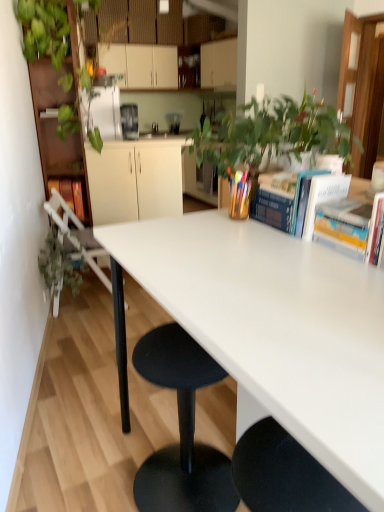
What do you see at coordinates (44, 29) in the screenshot? The image size is (384, 512). I see `green leafy plant at upper left` at bounding box center [44, 29].

Describe the element at coordinates (269, 133) in the screenshot. I see `green matte plant at center` at that location.

What is the approximate width of white plastic chair at left?

It is 20.20 inches.

Measure the distance between point [220,62] and camera.

A distance of 5.04 meters exists between point [220,62] and camera.

In order to click on matte white cabinets at upper center, placed as the second cabinetry when sorted from bottom to top in this screenshot , I will do [x=141, y=65].

This screenshot has width=384, height=512. What do you see at coordinates (323, 197) in the screenshot?
I see `blue hardcover book at upper right, positioned as the 3th book in back-to-front order` at bounding box center [323, 197].

Where is `blue hardcover book at upper right, the third book in the front-to-back sequence`? blue hardcover book at upper right, the third book in the front-to-back sequence is located at coordinates (323, 197).

What are the coordinates of `metallic silver toaster at center, the second appliance positioned from the left` in the screenshot? It's located at [174, 122].

This screenshot has width=384, height=512. What do you see at coordinates (351, 227) in the screenshot?
I see `hardcover book at upper right, the 2th book from the front` at bounding box center [351, 227].

Image resolution: width=384 pixels, height=512 pixels. Find the location of `green leafy plant at upper left`. green leafy plant at upper left is located at coordinates (44, 29).

How distant is white glossy table at center from black plastic stool at center?

They are 26.93 inches apart.

Does white glossy table at center lie in front of black plastic stool at center?

Yes, white glossy table at center is closer to the viewer.

Which point is more distant from viewer, (196, 279) or (214, 450)?

Positioned behind is point (214, 450).

Which object is positioned more to the left, white glossy table at center or black plastic stool at center?

From the viewer's perspective, black plastic stool at center appears more on the left side.

Are white plastic chair at left and green leafy plant at upper left located far from each other?

That's not correct — white plastic chair at left is a little close to green leafy plant at upper left.

Could you tell me if white plastic chair at left is turned towards green leafy plant at upper left?

No, white plastic chair at left does not turn towards green leafy plant at upper left.

The height and width of the screenshot is (512, 384). Identify the location of chair below the green leafy plant at upper left (from a real-world perspective). (78, 237).

Considering the sizes of hardcover book at upper right, acting as the 2th book starting from the back, and hardcover book at left, the 5th book from the right, in the image, is hardcover book at upper right, acting as the 2th book starting from the back, bigger or smaller than hardcover book at left, the 5th book from the right,?

In the image, hardcover book at upper right, acting as the 2th book starting from the back, appears to be smaller than hardcover book at left, the 5th book from the right.

Which is closer, (272, 196) or (67, 185)?

The point (272, 196) is closer.

Considering the sizes of objects hardcover book at upper right, positioned as the 4th book in front-to-back order, and hardcover book at left, which is counted as the 5th book, starting from the front, in the image provided, who is taller, hardcover book at upper right, positioned as the 4th book in front-to-back order, or hardcover book at left, which is counted as the 5th book, starting from the front,?

hardcover book at left, which is counted as the 5th book, starting from the front, is taller.

Is metallic stainless steel coffee machine at center, acting as the 2th appliance starting from the back, located within metallic silver toaster at center, arranged as the second appliance when ordered from the bottom?

No, metallic silver toaster at center, arranged as the second appliance when ordered from the bottom, does not contain metallic stainless steel coffee machine at center, acting as the 2th appliance starting from the back.

Relative to metallic stainless steel coffee machine at center, marked as the 1th appliance in a bottom-to-top arrangement, is metallic silver toaster at center, which ranks as the 1th appliance in right-to-left order, in front or behind?

Clearly, metallic silver toaster at center, which ranks as the 1th appliance in right-to-left order, is behind metallic stainless steel coffee machine at center, marked as the 1th appliance in a bottom-to-top arrangement.

Based on their positions, is metallic silver toaster at center, the first appliance positioned from the top, located to the left or right of metallic stainless steel coffee machine at center, arranged as the 1th appliance when viewed from the left?

From the image, it's evident that metallic silver toaster at center, the first appliance positioned from the top, is to the right of metallic stainless steel coffee machine at center, arranged as the 1th appliance when viewed from the left.

Consider the image. From a real-world perspective, is metallic silver toaster at center, arranged as the second appliance when ordered from the bottom, under metallic stainless steel coffee machine at center, the second appliance positioned from the top?

Yes, from a real-world perspective, metallic silver toaster at center, arranged as the second appliance when ordered from the bottom, is under metallic stainless steel coffee machine at center, the second appliance positioned from the top.

Looking at this image, from a real-world perspective, who is located lower, metallic stainless steel coffee machine at center, which appears as the 2th appliance when viewed from the right, or hardcover book at upper right, positioned as the 4th book in front-to-back order?

hardcover book at upper right, positioned as the 4th book in front-to-back order, from a real-world perspective.

Is metallic stainless steel coffee machine at center, marked as the 1th appliance in a bottom-to-top arrangement, with hardcover book at upper right, which is the second book in left-to-right order?

They are not placed beside each other.

Which point is more forward, (130,130) or (263,218)?

The point (263,218) is closer.

Is green leafy plant at left closer to camera compared to green matte plant at center?

No, green leafy plant at left is further to the viewer.

Which of these two, green leafy plant at left or green matte plant at center, stands shorter?

With less height is green matte plant at center.

The image size is (384, 512). I want to click on book located behind the white matte cabinet at center, the second cabinetry from the back, so click(x=69, y=194).

Would you say hardcover book at left, which is the 1th book in left-to-right order, contains white matte cabinet at center, the second cabinetry when ordered from top to bottom?

No, white matte cabinet at center, the second cabinetry when ordered from top to bottom, is located outside of hardcover book at left, which is the 1th book in left-to-right order.

From the image's perspective, is hardcover book at left, which is the 1th book in left-to-right order, below white matte cabinet at center, placed as the first cabinetry when sorted from front to back?

Yes.

Is hardcover book at left, which is the 1th book in left-to-right order, directly adjacent to white matte cabinet at center, the second cabinetry when ordered from top to bottom?

No, hardcover book at left, which is the 1th book in left-to-right order, is not beside white matte cabinet at center, the second cabinetry when ordered from top to bottom.

Find the location of a particular element. This screenshot has height=512, width=384. stool behind the white glossy table at center is located at coordinates (181, 430).

The width and height of the screenshot is (384, 512). I want to click on vegetation that is above the white plastic chair at left (from a real-world perspective), so click(x=44, y=29).

Estimate the real-world distances between objects in this image. Which object is further from hardcover book at upper right, the 2th book from the front, hardcover book at upper right, positioned as the 1th book in front-to-back order, or green leafy plant at upper left?

green leafy plant at upper left.

Based on their spatial positions, is black plastic stool at center or blue hardcover book at upper right, the third book in the front-to-back sequence, further from green leafy plant at left?

blue hardcover book at upper right, the third book in the front-to-back sequence, is positioned further to the anchor green leafy plant at left.

Looking at the image, which one is located further to hardcover book at upper right, the 4th book in the back-to-front sequence, blue hardcover book at upper right, the third book positioned from the left, or metallic stainless steel coffee machine at center, acting as the 2th appliance starting from the back?

Among the two, metallic stainless steel coffee machine at center, acting as the 2th appliance starting from the back, is located further to hardcover book at upper right, the 4th book in the back-to-front sequence.

Which object lies further to the anchor point hardcover book at upper right, the 2th book from the front, hardcover book at left, the 5th book from the right, or green leafy plant at upper left?

The object further to hardcover book at upper right, the 2th book from the front, is hardcover book at left, the 5th book from the right.

From the picture: Estimate the real-world distances between objects in this image. Which object is closer to green leafy plant at upper left, metallic stainless steel coffee machine at center, which appears as the 2th appliance when viewed from the right, or green matte bookshelf at left?

Based on the image, green matte bookshelf at left appears to be nearer to green leafy plant at upper left.

From the image, which object appears to be nearer to hardcover book at upper right, positioned as the 1th book in front-to-back order, white plastic chair at left or green leafy plant at upper left?

white plastic chair at left is positioned closer to the anchor hardcover book at upper right, positioned as the 1th book in front-to-back order.

Looking at the image, which one is located closer to hardcover book at upper right, the 4th book in the back-to-front sequence, green leafy plant at left or matte white cabinets at upper center, the first cabinetry when ordered from top to bottom?

Based on the image, green leafy plant at left appears to be nearer to hardcover book at upper right, the 4th book in the back-to-front sequence.

From the image, which object appears to be nearer to white matte cabinet at center, the second cabinetry from the back, green matte bookshelf at left or hardcover book at upper right, which is the second book in left-to-right order?

green matte bookshelf at left.

The image size is (384, 512). Find the location of `houseplant situated between green leafy plant at upper left and hardcover book at upper right, which is the second book in left-to-right order, from left to right`. houseplant situated between green leafy plant at upper left and hardcover book at upper right, which is the second book in left-to-right order, from left to right is located at coordinates (269, 133).

Image resolution: width=384 pixels, height=512 pixels. In order to click on chair between green matte bookshelf at left and blue hardcover book at upper right, the third book in the front-to-back sequence, in the horizontal direction in this screenshot , I will do `click(78, 237)`.

This screenshot has width=384, height=512. I want to click on vegetation between green leafy plant at left and metallic silver toaster at center, the first appliance positioned from the top, along the z-axis, so click(x=44, y=29).

The image size is (384, 512). Find the location of `plant positioned between hardcover book at upper right, the 4th book in the back-to-front sequence, and matte white cabinets at upper center, the 1th cabinetry when ordered from back to front, from near to far`. plant positioned between hardcover book at upper right, the 4th book in the back-to-front sequence, and matte white cabinets at upper center, the 1th cabinetry when ordered from back to front, from near to far is located at coordinates (59, 264).